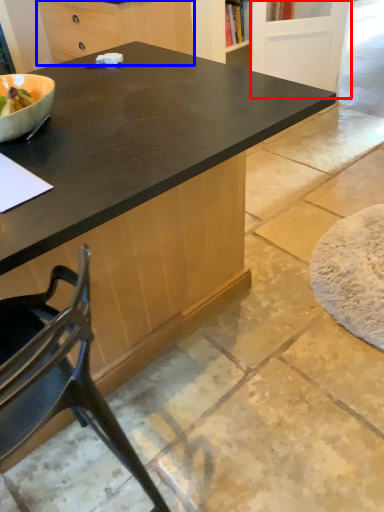
Question: Which object is closer to the camera taking this photo, screen door (highlighted by a red box) or cabinetry (highlighted by a blue box)?

Choices:
 (A) screen door
 (B) cabinetry

Answer: (B)